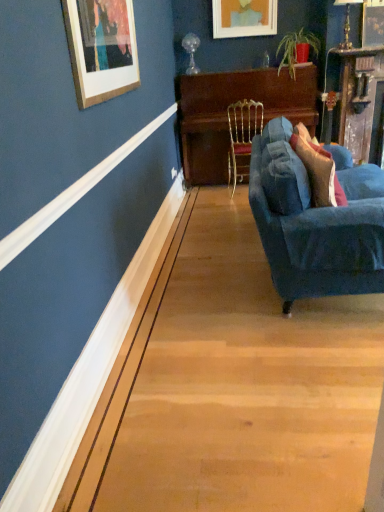
Describe the element at coordinates (242, 137) in the screenshot. This screenshot has width=384, height=512. I see `gold metallic chair at center` at that location.

Identify the location of gold metallic chair at center. [242, 137].

Image resolution: width=384 pixels, height=512 pixels. I want to click on matte wooden picture frame at upper center, which is counted as the first picture frame, starting from the top, so click(x=244, y=18).

The image size is (384, 512). What do you see at coordinates (316, 222) in the screenshot?
I see `velvet blue couch at right` at bounding box center [316, 222].

In order to face velvet blue couch at right, should I rotate leftwards or rightwards?

It's best to rotate right around 18.027 degrees.

Find the location of a particular element. The image size is (384, 512). wooden piano at center is located at coordinates (227, 116).

Find the location of a particular element. This screenshot has height=512, width=384. wooden picture frame at upper right, which ranks as the 1th picture frame in bottom-to-top order is located at coordinates (373, 23).

The image size is (384, 512). What are the coordinates of `gold metallic chair at center` in the screenshot? It's located at (242, 137).

Is gold metallic chair at center looking in the opposite direction of matte wooden picture frame at upper center, which is the 2th picture frame in front-to-back order?

No, gold metallic chair at center's orientation is not away from matte wooden picture frame at upper center, which is the 2th picture frame in front-to-back order.

Is gold metallic chair at center further to the viewer compared to matte wooden picture frame at upper center, positioned as the second picture frame in bottom-to-top order?

No, the depth of gold metallic chair at center is less than that of matte wooden picture frame at upper center, positioned as the second picture frame in bottom-to-top order.

Which is more to the left, gold metallic chair at center or matte wooden picture frame at upper center, which is the 2th picture frame in front-to-back order?

matte wooden picture frame at upper center, which is the 2th picture frame in front-to-back order.

Considering the positions of points (244, 105) and (249, 25), is point (244, 105) farther from camera compared to point (249, 25)?

No, (244, 105) is closer to viewer.

Based on the photo, from the image's perspective, is velvet blue couch at right on gold metallic chair at center?

No, from the image's perspective, velvet blue couch at right is not above gold metallic chair at center.

Which object is further away from the camera taking this photo, velvet blue couch at right or gold metallic chair at center?

gold metallic chair at center is behind.

Is velvet blue couch at right facing towards gold metallic chair at center?

No.

Considering the relative sizes of gold metallic chair at center and wooden piano at center in the image provided, is gold metallic chair at center thinner than wooden piano at center?

Yes.

Is gold metallic chair at center completely or partially outside of wooden piano at center?

No, most part of gold metallic chair at center lies within wooden piano at center.

Does point (237, 175) come closer to viewer compared to point (251, 70)?

No, (237, 175) is behind (251, 70).

From the picture: Measure the distance between velvet blue pillow at right and matte wooden picture frame at upper center, which is counted as the first picture frame, starting from the top.

velvet blue pillow at right is 7.11 feet away from matte wooden picture frame at upper center, which is counted as the first picture frame, starting from the top.

Based on their sizes in the image, would you say velvet blue pillow at right is bigger or smaller than matte wooden picture frame at upper center, which is counted as the first picture frame, starting from the top?

In the image, velvet blue pillow at right appears to be larger than matte wooden picture frame at upper center, which is counted as the first picture frame, starting from the top.

From the picture: Which object is closer to the camera, velvet blue pillow at right or matte wooden picture frame at upper center, positioned as the 1th picture frame in left-to-right order?

velvet blue pillow at right is more forward.

Which is in front, point (313, 193) or point (254, 9)?

The point (313, 193) is closer to the camera.

Is wooden piano at center bigger than velvet blue couch at right?

No.

Is wooden piano at center taller than velvet blue couch at right?

Yes, wooden piano at center is taller than velvet blue couch at right.

From a real-world perspective, who is located higher, wooden piano at center or velvet blue couch at right?

wooden piano at center.

Locate an element on the screen. table that is above the velvet blue couch at right (from a real-world perspective) is located at coordinates (227, 116).

Between wooden piano at center and wooden picture frame at upper right, the second picture frame in the left-to-right sequence, which one has less height?

wooden picture frame at upper right, the second picture frame in the left-to-right sequence.

Does wooden piano at center have a smaller size compared to wooden picture frame at upper right, which ranks as the 1th picture frame in bottom-to-top order?

Actually, wooden piano at center might be larger than wooden picture frame at upper right, which ranks as the 1th picture frame in bottom-to-top order.

In the image, is wooden piano at center on the left side or the right side of wooden picture frame at upper right, which is the first picture frame in right-to-left order?

Based on their positions, wooden piano at center is located to the left of wooden picture frame at upper right, which is the first picture frame in right-to-left order.

Is point (281, 93) closer to viewer compared to point (372, 44)?

No, (281, 93) is further to viewer.

Considering the relative positions of velvet blue couch at right and matte wooden picture frame at upper center, positioned as the 1th picture frame in left-to-right order, in the image provided, is velvet blue couch at right to the right of matte wooden picture frame at upper center, positioned as the 1th picture frame in left-to-right order, from the viewer's perspective?

Indeed, velvet blue couch at right is positioned on the right side of matte wooden picture frame at upper center, positioned as the 1th picture frame in left-to-right order.

Consider the image. From the image's perspective, which one is positioned higher, velvet blue couch at right or matte wooden picture frame at upper center, which is counted as the first picture frame, starting from the top?

matte wooden picture frame at upper center, which is counted as the first picture frame, starting from the top.

Does velvet blue couch at right turn towards matte wooden picture frame at upper center, placed as the 2th picture frame when sorted from right to left?

No, velvet blue couch at right is not turned towards matte wooden picture frame at upper center, placed as the 2th picture frame when sorted from right to left.

Locate an element on the screen. The width and height of the screenshot is (384, 512). studio couch that is below the matte wooden picture frame at upper center, positioned as the second picture frame in bottom-to-top order (from the image's perspective) is located at coordinates (316, 222).

The width and height of the screenshot is (384, 512). What are the coordinates of `picture frame on the left of gold metallic chair at center` in the screenshot? It's located at (244, 18).

This screenshot has width=384, height=512. I want to click on studio couch below the gold metallic chair at center (from the image's perspective), so click(316, 222).

Looking at this image, when comparing their distances from gold metallic chair at center, does wooden picture frame at upper right, positioned as the second picture frame in top-to-bottom order, or velvet blue couch at right seem closer?

wooden picture frame at upper right, positioned as the second picture frame in top-to-bottom order, lies closer to gold metallic chair at center than the other object.

Considering their positions, is velvet blue couch at right positioned further to gold metallic chair at center than wooden piano at center?

Among the two, velvet blue couch at right is located further to gold metallic chair at center.

Looking at the image, which one is located closer to velvet blue couch at right, gold metallic chair at center or matte wooden picture frame at upper center, positioned as the 1th picture frame in left-to-right order?

gold metallic chair at center lies closer to velvet blue couch at right than the other object.

Which object lies nearer to the anchor point velvet blue pillow at right, wooden piano at center or wooden picture frame at upper right, marked as the 2th picture frame in a back-to-front arrangement?

The object closer to velvet blue pillow at right is wooden piano at center.

Looking at the image, which one is located closer to wooden picture frame at upper right, the second picture frame in the left-to-right sequence, wooden piano at center or velvet blue couch at right?

wooden piano at center.

When comparing their distances from wooden picture frame at upper right, positioned as the second picture frame in top-to-bottom order, does velvet blue pillow at right or gold metallic chair at center seem closer?

Among the two, gold metallic chair at center is located nearer to wooden picture frame at upper right, positioned as the second picture frame in top-to-bottom order.

Based on their spatial positions, is velvet blue couch at right or wooden picture frame at upper right, marked as the first picture frame in a front-to-back arrangement, further from wooden piano at center?

velvet blue couch at right is further to wooden piano at center.

Considering their positions, is gold metallic chair at center positioned further to velvet blue pillow at right than matte wooden picture frame at upper center, positioned as the 1th picture frame in left-to-right order?

matte wooden picture frame at upper center, positioned as the 1th picture frame in left-to-right order, is further to velvet blue pillow at right.

Where is `picture frame between velvet blue pillow at right and wooden piano at center along the z-axis`? picture frame between velvet blue pillow at right and wooden piano at center along the z-axis is located at coordinates (373, 23).

This screenshot has width=384, height=512. Find the location of `chair between velvet blue pillow at right and wooden piano at center from front to back`. chair between velvet blue pillow at right and wooden piano at center from front to back is located at coordinates (242, 137).

Identify the location of table between velvet blue pillow at right and matte wooden picture frame at upper center, the 1th picture frame from the back, in the front-back direction. Image resolution: width=384 pixels, height=512 pixels. (227, 116).

Locate an element on the screen. pillow between velvet blue couch at right and wooden picture frame at upper right, which ranks as the 1th picture frame in bottom-to-top order, from front to back is located at coordinates (318, 169).